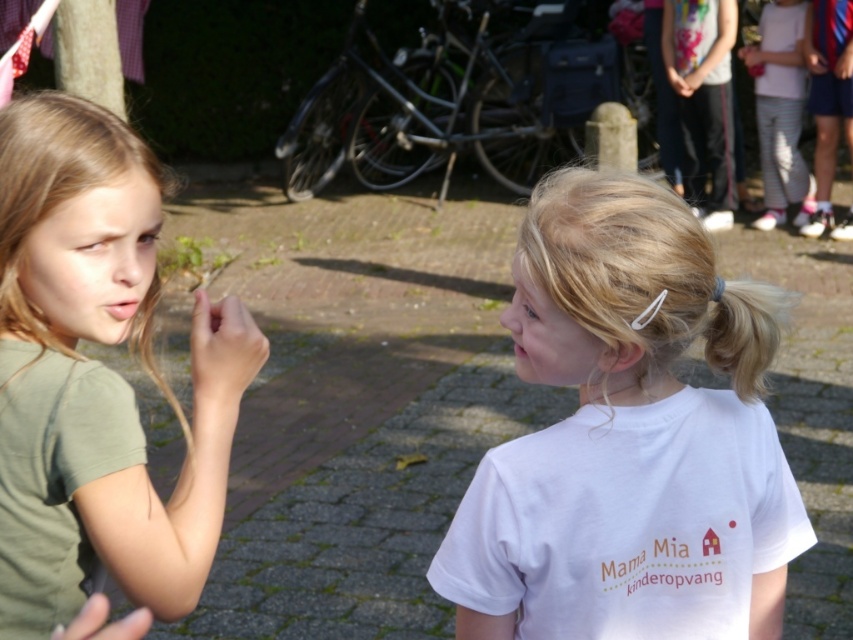
Question: Which point is farther to the camera?

Choices:
 (A) (796, 26)
 (B) (94, 476)
 (C) (782, 557)

Answer: (A)

Question: Based on their relative distances, which object is farther from the matte green shirt at left?

Choices:
 (A) white matte t-shirt at center
 (B) white striped pants at upper right

Answer: (B)

Question: Does matte green shirt at left appear on the right side of white striped pants at upper right?

Choices:
 (A) yes
 (B) no

Answer: (B)

Question: Is matte green shirt at left smaller than white striped pants at upper right?

Choices:
 (A) yes
 (B) no

Answer: (A)

Question: Considering the relative positions of white matte t-shirt at center and white striped pants at upper right in the image provided, where is white matte t-shirt at center located with respect to white striped pants at upper right?

Choices:
 (A) right
 (B) left

Answer: (B)

Question: Which point is closer to the camera?

Choices:
 (A) (18, 184)
 (B) (770, 83)

Answer: (A)